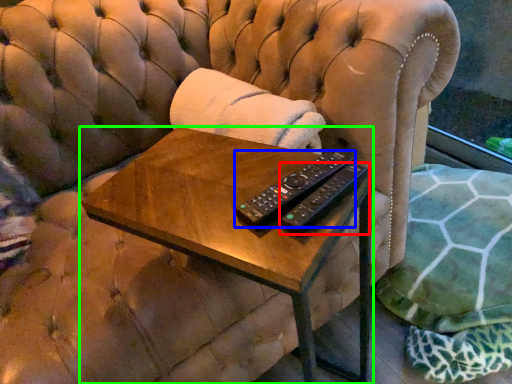
Question: Which object is positioned closest to remote control (highlighted by a red box)? Select from remote control (highlighted by a blue box) and table (highlighted by a green box).

Choices:
 (A) remote control
 (B) table

Answer: (A)